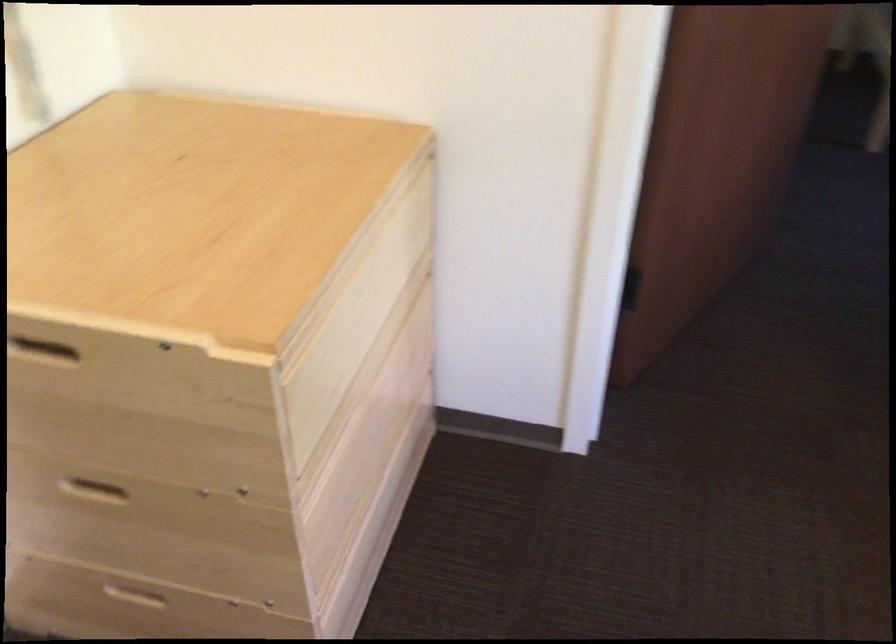
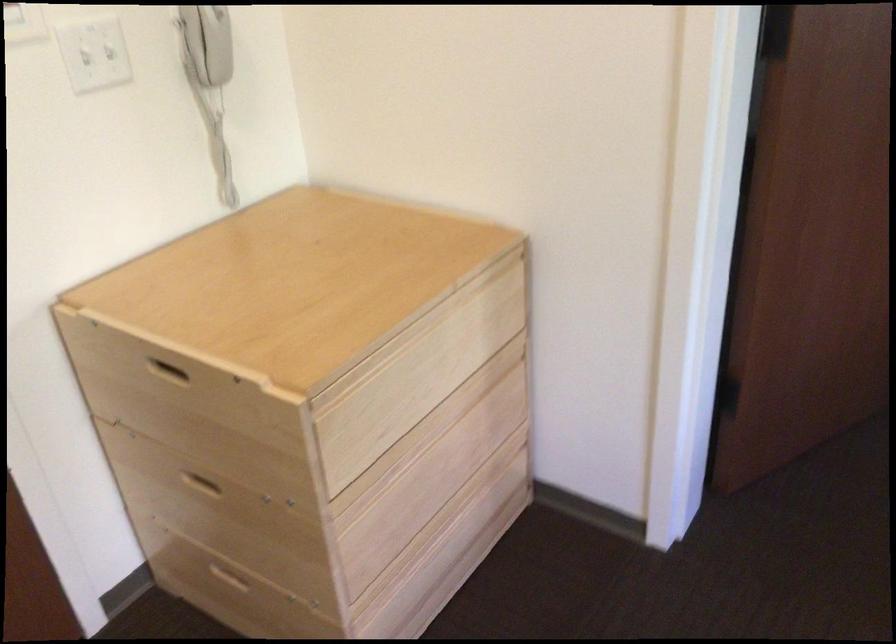
Locate, in the second image, the point that corresponds to point 91,484 in the first image.

(201, 483)